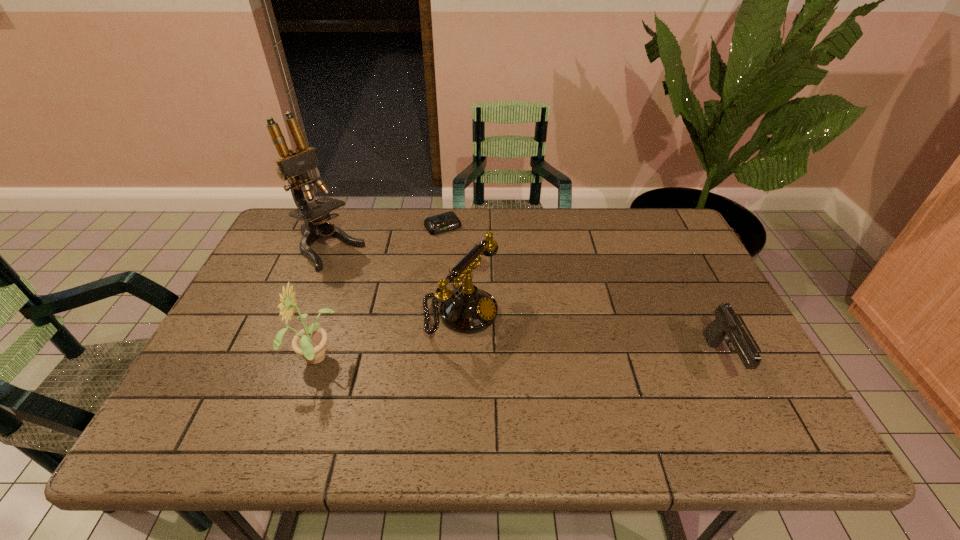
The width and height of the screenshot is (960, 540). I want to click on unoccupied position between the sunflower and the rightmost object, so click(519, 361).

Image resolution: width=960 pixels, height=540 pixels. I want to click on object that is the third closest one to the second shortest object, so 310,342.

Select which object appears as the third closest to the fourth tallest object. Please provide its 2D coordinates. Your answer should be formatted as a tuple, i.e. [(x, y)], where the tuple contains the x and y coordinates of a point satisfying the conditions above.

[(310, 342)]

Image resolution: width=960 pixels, height=540 pixels. I want to click on vacant area in the image that satisfies the following two spatial constraints: 1. on the front side of the sunflower; 2. on the front-facing side of the microscope, so click(283, 361).

At what (x,y) coordinates should I click in order to perform the action: click on vacant position in the image that satisfies the following two spatial constraints: 1. on the front side of the tallest object; 2. on the front-facing side of the sunflower. Please return your answer as a coordinate pair (x, y). Looking at the image, I should click on (283, 361).